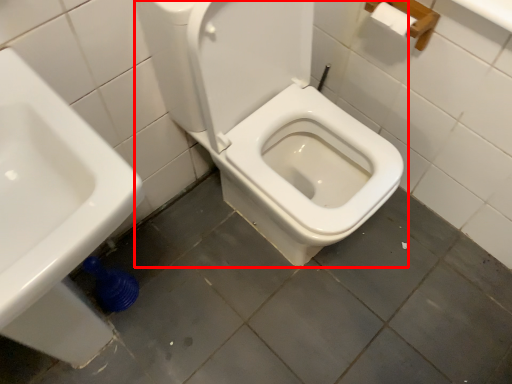
Question: From the image, what is the correct spatial relationship of toilet (annotated by the red box) in relation to sink?

Choices:
 (A) right
 (B) left

Answer: (A)